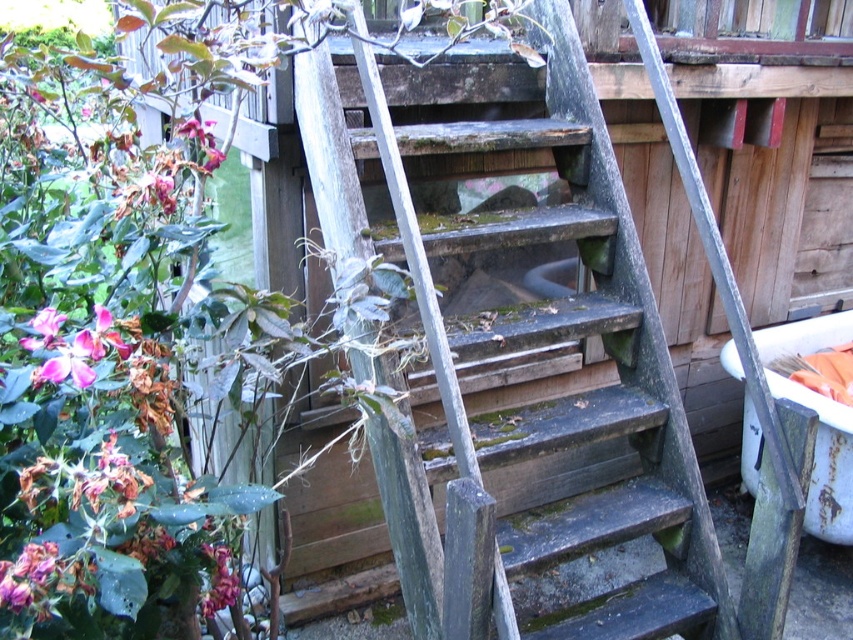
Question: Estimate the real-world distances between objects in this image. Which object is closer to the weathered wood ladder at center?

Choices:
 (A) pink matte flower at lower left
 (B) pink matte flower at left
 (C) white plastic tub at right

Answer: (A)

Question: Does white plastic tub at right lie in front of pink matte flower at lower left?

Choices:
 (A) no
 (B) yes

Answer: (A)

Question: Which point appears farthest from the camera in this image?

Choices:
 (A) (223, 605)
 (B) (839, 532)
 (C) (54, 316)

Answer: (B)

Question: Which point is farther to the camera?

Choices:
 (A) (450, 490)
 (B) (223, 598)
 (C) (70, 365)
 (D) (788, 344)

Answer: (D)

Question: Can you confirm if weathered wood ladder at center is bigger than pink matte flower at lower left?

Choices:
 (A) yes
 (B) no

Answer: (A)

Question: Can you confirm if pink matte flower at left is smaller than pink matte flower at lower left?

Choices:
 (A) no
 (B) yes

Answer: (B)